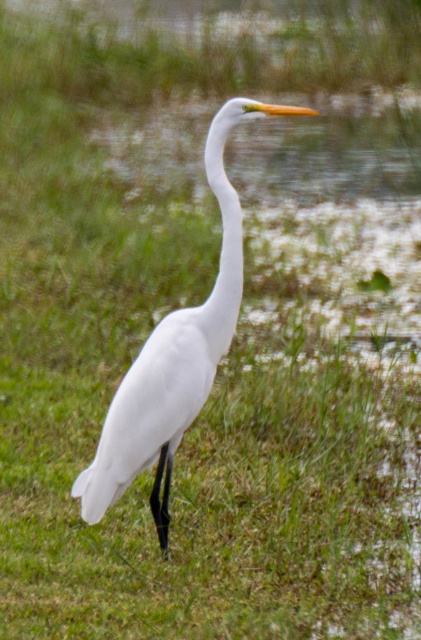
You are a wildlife photographer trying to capture the Great Egret in the scene. You notice the white matte bird at center and the white smooth neck at center. Which object should you focus on if you want to photograph the larger one?

The white matte bird at center is bigger than the white smooth neck at center, so you should focus on the white matte bird at center.

You are a wildlife photographer trying to capture the Great Egret in the scene. You need to ensure that both the white matte bird at center and the white smooth neck at center are in focus. Given that your camera can only focus on objects within a 10 inch range, will both objects be in focus?

The white matte bird at center and the white smooth neck at center are 11.79 inches apart from each other. Since the camera can only focus on objects within a 10 inch range, the distance between them exceeds the camera focus range, so both objects may not be in focus simultaneously.